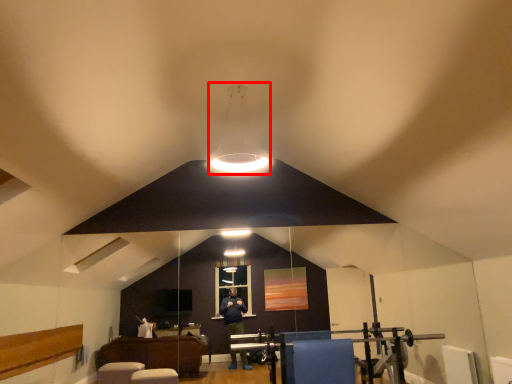
Question: From the image's perspective, where is lamp (annotated by the red box) located relative to furniture?

Choices:
 (A) above
 (B) below

Answer: (A)